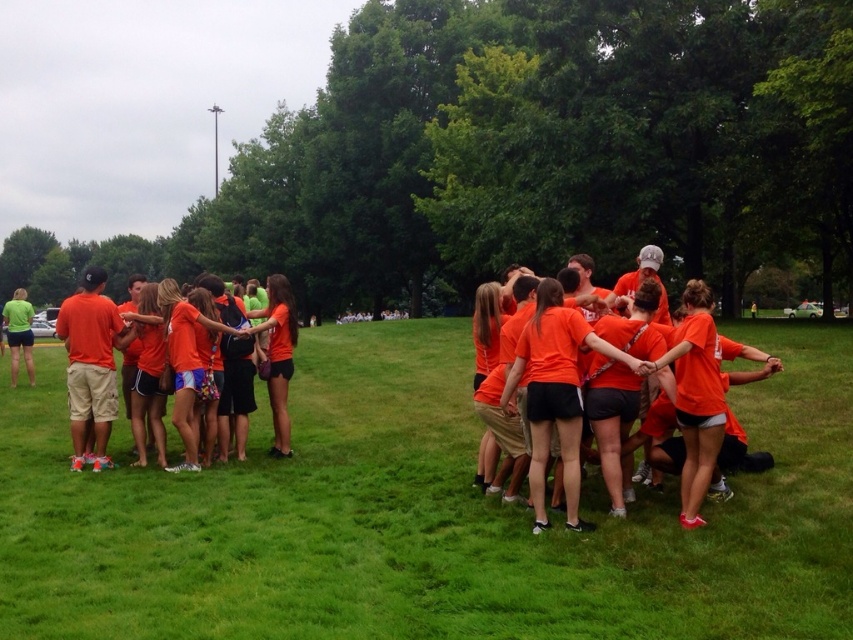
You are a photographer trying to capture a group photo of the orange fabric shirt at center and the matte green shirt at left. Based on their heights, which one should you position closer to the camera to ensure both appear equally tall in the photo?

The orange fabric shirt at center is shorter than the matte green shirt at left. To make them appear equally tall in the photo, position the orange fabric shirt at center closer to the camera than the matte green shirt at left.

You are planning to set up a small tent for a picnic in the park where the group is standing. The tent requires a flat area of at least 20 feet between the green grass at center and the orange fabric shirt at center. Is the available space sufficient?

The green grass at center is 22.62 feet from the orange fabric shirt at center, which is more than the required 20 feet. Therefore, the available space is sufficient for the tent.

You are a photographer planning to take a group photo of the people in the park. You want to ensure that both the green grass at center and the orange fabric shirt at center are clearly visible in the photo. Based on their positions, which object should appear lower in the frame?

The green grass at center is located below the orange fabric shirt at center, so in the photo frame, the green grass at center will appear lower than the orange fabric shirt at center.